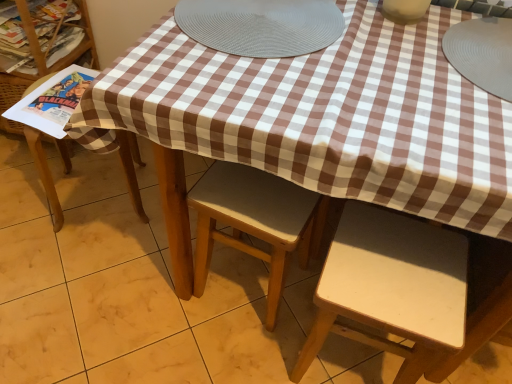
At what (x,y) coordinates should I click in order to perform the action: click on free space in front of wooden chair at left, which ranks as the 1th chair in left-to-right order. Please return your answer as a coordinate pair (x, y). This screenshot has height=384, width=512. Looking at the image, I should click on (77, 261).